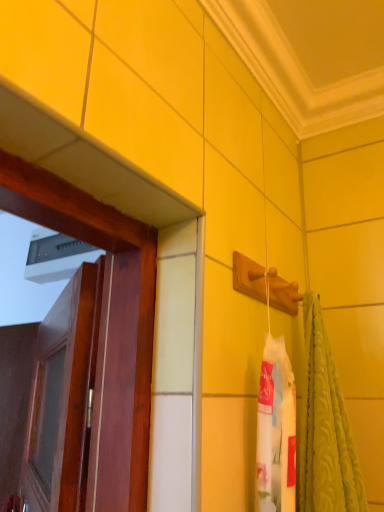
The height and width of the screenshot is (512, 384). What do you see at coordinates (248, 277) in the screenshot?
I see `wooden at upper right` at bounding box center [248, 277].

Locate an element on the screen. wooden at upper right is located at coordinates (248, 277).

Measure the distance between point [297,294] and camera.

Point [297,294] and camera are 34.41 inches apart.

Image resolution: width=384 pixels, height=512 pixels. What are the coordinates of `wooden at upper right` in the screenshot? It's located at (248, 277).